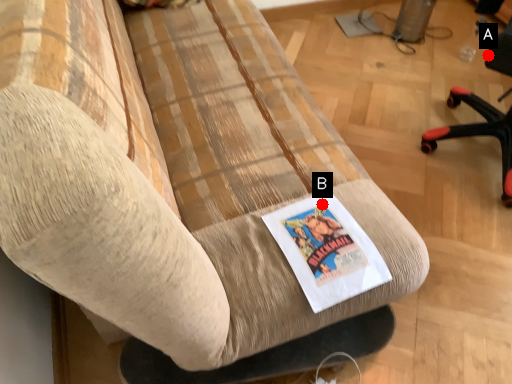
Question: Two points are circled on the image, labeled by A and B beside each circle. Which point is closer to the camera?

Choices:
 (A) A is closer
 (B) B is closer

Answer: (B)